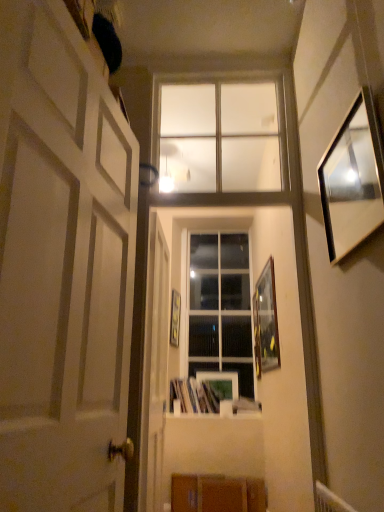
Question: Based on their positions, is matte wooden picture frame at center, marked as the 4th picture frame in a front-to-back arrangement, located to the left or right of white matte door at left, the second door in the back-to-front sequence?

Choices:
 (A) right
 (B) left

Answer: (A)

Question: From the image's perspective, is matte wooden picture frame at center, marked as the 4th picture frame in a front-to-back arrangement, located above or below white matte door at left, the second door in the back-to-front sequence?

Choices:
 (A) above
 (B) below

Answer: (B)

Question: Which object is positioned farthest from the wooden at lower center?

Choices:
 (A) white glossy door at center, which is the first door from back to front
 (B) wooden picture frame at right, the 1th picture frame in the right-to-left sequence
 (C) wooden picture frame at center, marked as the second picture frame in a back-to-front arrangement
 (D) white matte door at left, which appears as the first door when viewed from the front
 (E) clear glass window at upper center, the second window viewed from the back

Answer: (D)

Question: Estimate the real-world distances between objects in this image. Which object is farther from the wooden picture frame at center, which ranks as the third picture frame in front-to-back order?

Choices:
 (A) white glossy door at center, which is the first door from back to front
 (B) matte black picture frame at upper right, positioned as the second picture frame in right-to-left order
 (C) clear glass window at upper center, the second window viewed from the back
 (D) white matte door at left, the second door in the back-to-front sequence
 (E) clear glass window at center, which is the 1th window from bottom to top

Answer: (D)